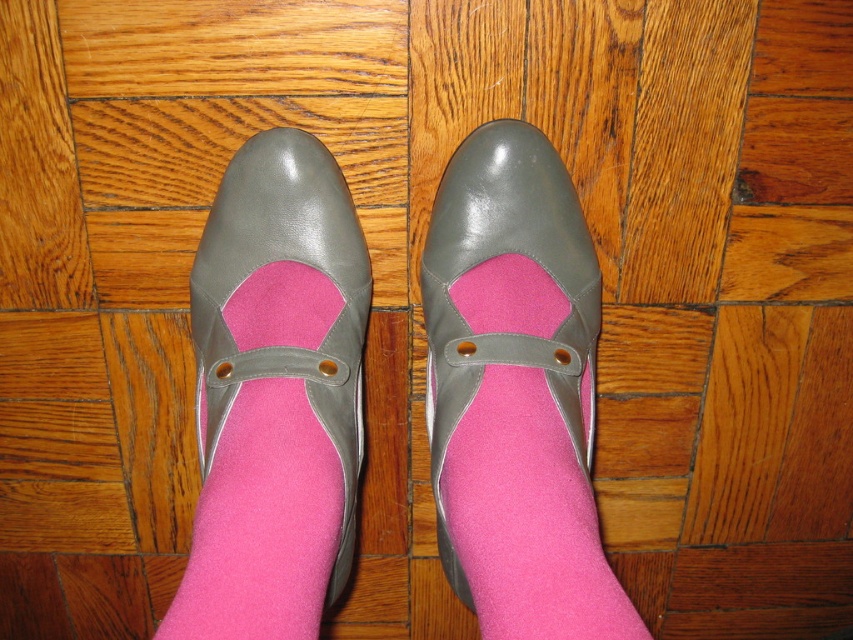
Question: Which object is farther from the camera taking this photo?

Choices:
 (A) matte gray shoe at center
 (B) matte gray sandal at center

Answer: (A)

Question: Where is matte gray sandal at center located in relation to matte gray shoe at center in the image?

Choices:
 (A) below
 (B) above

Answer: (A)

Question: Observing the image, what is the correct spatial positioning of matte gray sandal at center in reference to matte gray shoe at center?

Choices:
 (A) above
 (B) below

Answer: (B)

Question: Which object is closer to the camera taking this photo?

Choices:
 (A) matte gray shoe at center
 (B) matte gray sandal at center

Answer: (B)

Question: Can you confirm if matte gray sandal at center is positioned to the left of matte gray shoe at center?

Choices:
 (A) no
 (B) yes

Answer: (A)